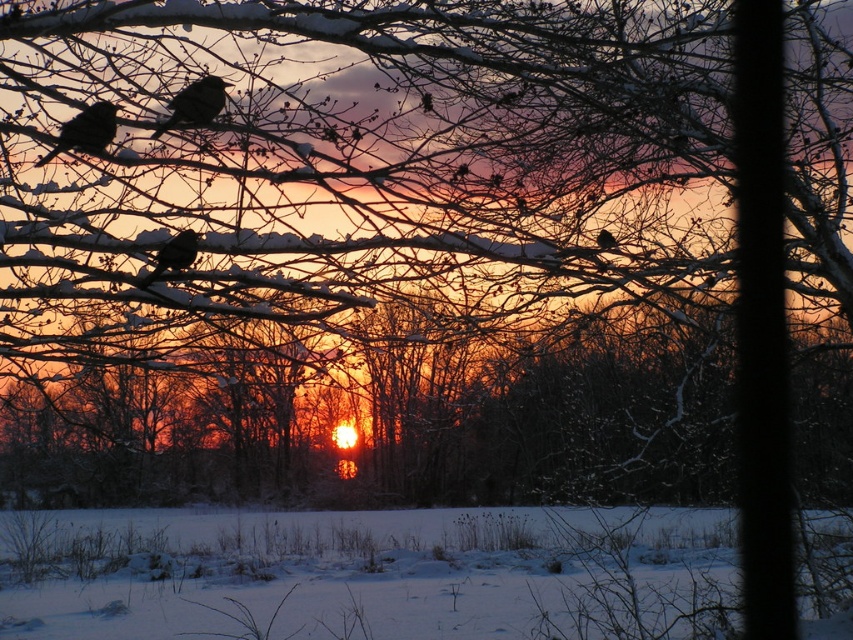
Does matte black bird at upper left have a lesser height compared to matte black bird at center?

No.

Is point (78, 122) in front of point (606, 248)?

Yes.

At what (x,y) coordinates should I click in order to perform the action: click on matte black bird at upper left. Please return your answer as a coordinate pair (x, y). This screenshot has width=853, height=640. Looking at the image, I should click on click(85, 131).

Which is in front, point (56, 145) or point (192, 234)?

Positioned in front is point (56, 145).

Between point (70, 122) and point (183, 230), which one is positioned in front?

Point (70, 122) is in front.

Image resolution: width=853 pixels, height=640 pixels. What are the coordinates of `matte black bird at upper left` in the screenshot? It's located at (85, 131).

Can you confirm if white powdery snow at center is bigger than black matte bird at upper left?

Correct, white powdery snow at center is larger in size than black matte bird at upper left.

Who is positioned more to the left, white powdery snow at center or black matte bird at upper left?

Positioned to the left is black matte bird at upper left.

Between point (502, 600) and point (187, 106), which one is positioned behind?

Point (502, 600)

Identify the location of white powdery snow at center. This screenshot has width=853, height=640. (369, 573).